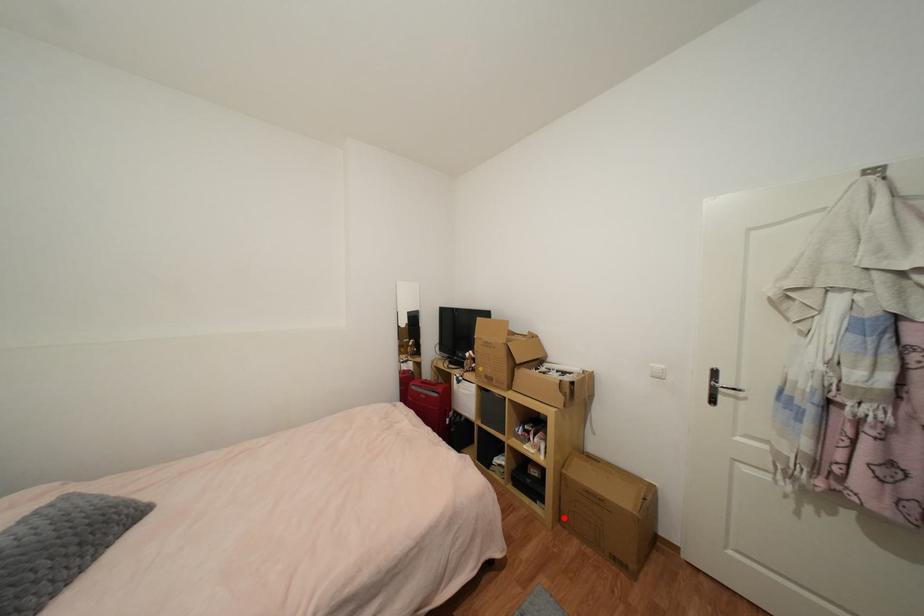
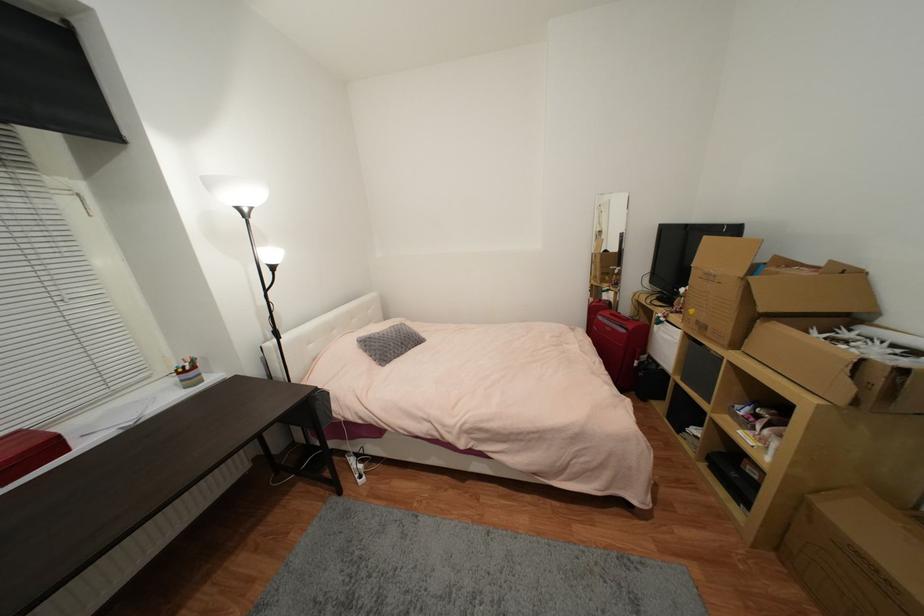
In the second image, find the point that corresponds to the highlighted location in the first image.

(782, 546)